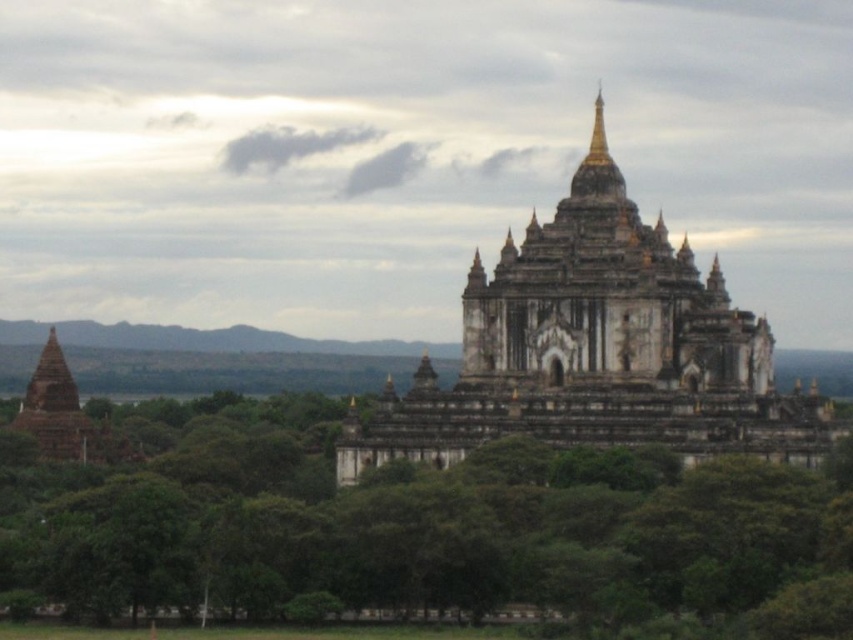
Question: Which object appears closest to the camera in this image?

Choices:
 (A) matte brown stupa at left
 (B) green leafy trees at center
 (C) white stone pagoda at center

Answer: (B)

Question: Can you confirm if green leafy trees at center is wider than white stone pagoda at center?

Choices:
 (A) yes
 (B) no

Answer: (A)

Question: Which object appears farthest from the camera in this image?

Choices:
 (A) matte brown stupa at left
 (B) green leafy trees at center
 (C) white stone pagoda at center

Answer: (A)

Question: Estimate the real-world distances between objects in this image. Which object is closer to the white stone pagoda at center?

Choices:
 (A) matte brown stupa at left
 (B) green leafy trees at center

Answer: (B)

Question: Does white stone pagoda at center appear on the left side of matte brown stupa at left?

Choices:
 (A) no
 (B) yes

Answer: (A)

Question: Does green leafy trees at center lie behind white stone pagoda at center?

Choices:
 (A) no
 (B) yes

Answer: (A)